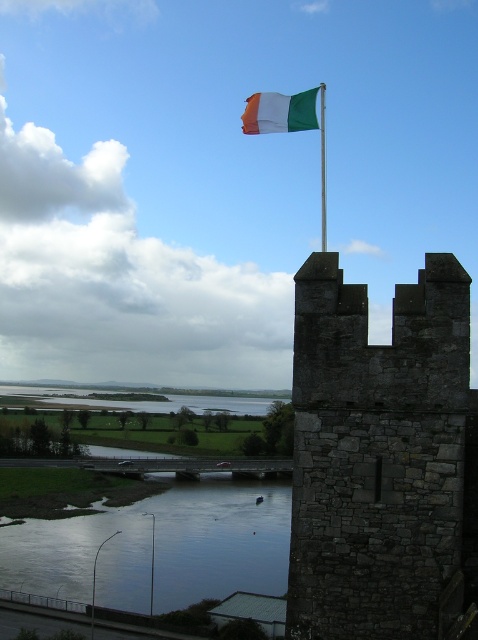
You are standing at the center of the image and want to reach the smooth reflective water at lower center. Which direction should you move in to get there?

The smooth reflective water at lower center is located at point (159, 547), so you should move downward and slightly to the right to reach it.